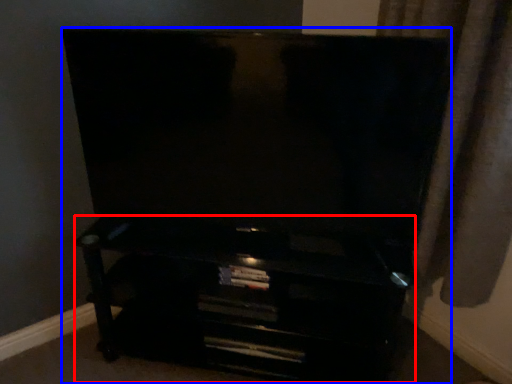
Question: Among these objects, which one is nearest to the camera, entertainment center (highlighted by a red box) or furniture (highlighted by a blue box)?

Choices:
 (A) entertainment center
 (B) furniture

Answer: (B)